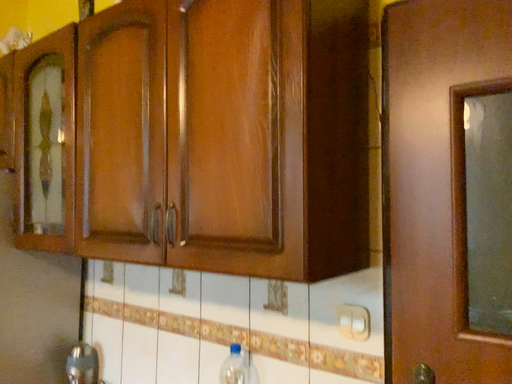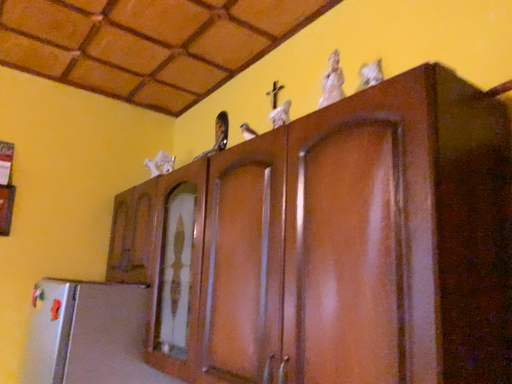
Question: Which way did the camera rotate in the video?

Choices:
 (A) rotated upward
 (B) rotated downward

Answer: (A)